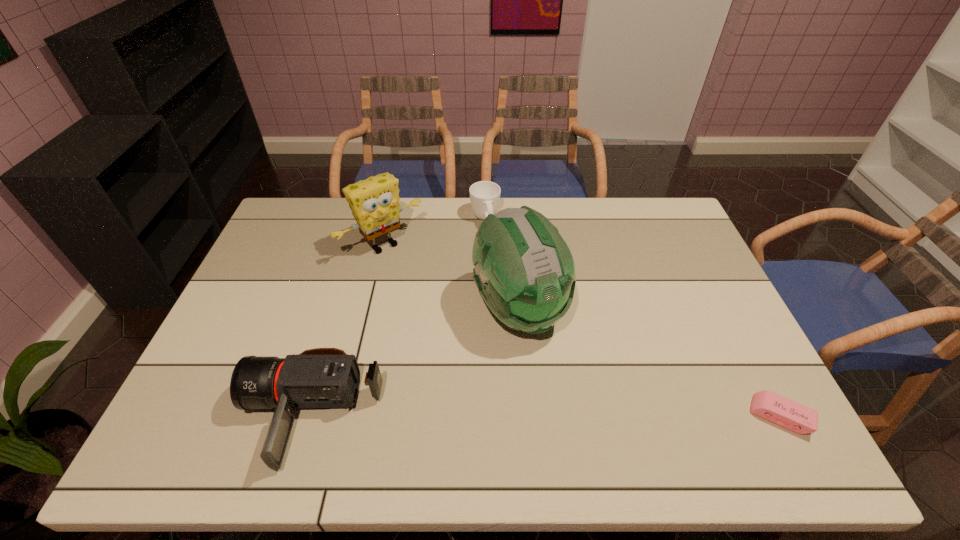
This screenshot has width=960, height=540. In order to click on free point at the far right corner in this screenshot , I will do point(673,219).

The width and height of the screenshot is (960, 540). Identify the location of unoccupied area between the third nearest object and the rightmost object. (649, 362).

In order to click on free space between the camcorder and the second tallest object in this screenshot , I will do `click(348, 330)`.

The image size is (960, 540). In order to click on vacant space that is in between the fourth shortest object and the cup in this screenshot , I will do `click(434, 232)`.

Locate an element on the screen. Image resolution: width=960 pixels, height=540 pixels. free point between the cup and the camcorder is located at coordinates (398, 317).

You are a GUI agent. You are given a task and a screenshot of the screen. Output one action in this format:
    pyautogui.click(x=<x>, y=<y>)
    Task: Click on the free area in between the eraser and the football helmet
    
    Given the screenshot: What is the action you would take?
    pyautogui.click(x=649, y=362)

Find the location of `vacant space that's between the sponge and the shortest object`. vacant space that's between the sponge and the shortest object is located at coordinates (582, 330).

Locate an element on the screen. This screenshot has width=960, height=540. free space that is in between the fourth shortest object and the football helmet is located at coordinates (450, 276).

Identify the location of vacant space that is in between the camcorder and the third nearest object. This screenshot has width=960, height=540. (416, 362).

What are the coordinates of `vacant region between the football helmet and the rightmost object` in the screenshot? It's located at (649, 362).